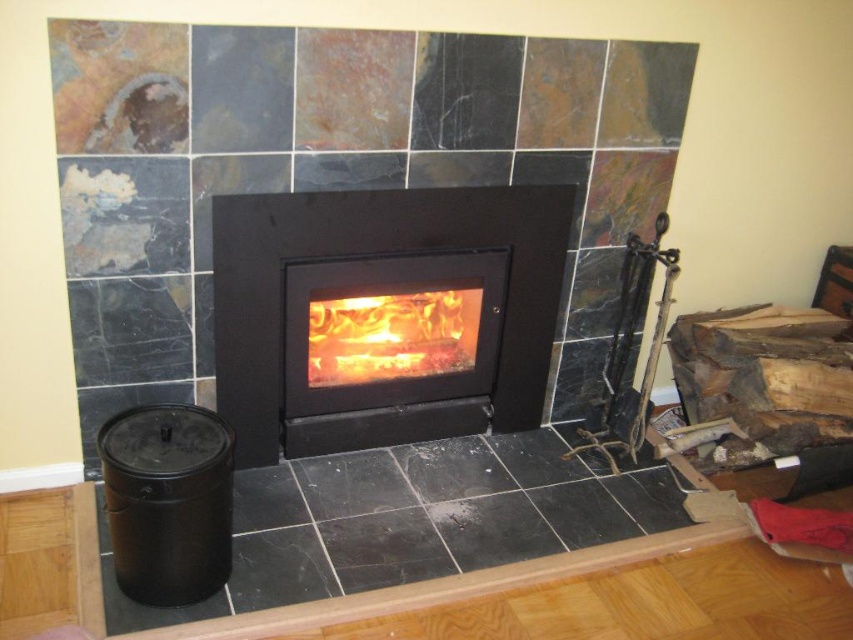
Is black matte fireplace at center to the left of flamewoodfireplace at center from the viewer's perspective?

Incorrect, black matte fireplace at center is not on the left side of flamewoodfireplace at center.

Between black matte fireplace at center and flamewoodfireplace at center, which one has less height?

With less height is flamewoodfireplace at center.

The height and width of the screenshot is (640, 853). In order to click on black matte fireplace at center in this screenshot , I will do `click(384, 314)`.

The image size is (853, 640). Identify the location of black matte fireplace at center. (384, 314).